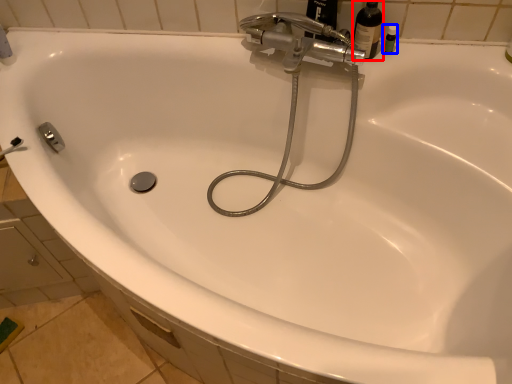
Question: Which point is closer to the camera, bottle (highlighted by a red box) or toiletry (highlighted by a blue box)?

Choices:
 (A) bottle
 (B) toiletry

Answer: (A)